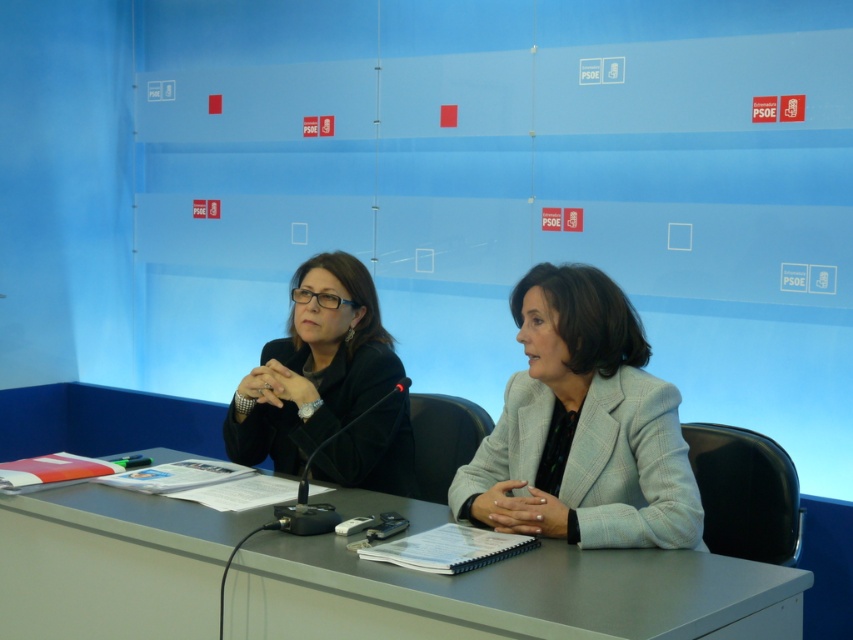
From the picture: You are a photographer at the event and need to adjust your camera to focus on both the light gray textured blazer at center and the black matte jacket at center. Since the camera can only focus on one plane at a time, which object should you focus on to ensure the other is also in focus? Explain your reasoning based on their positions.

The light gray textured blazer at center is below the black matte jacket at center. To ensure both are in focus, focus on the black matte jacket at center since it is closer to the camera. This way, the blazer, being further back, might still be within the depth of field.

What object is located at the coordinates point (508, 595) in the image?

The gray matte table at center is located at point (508, 595).